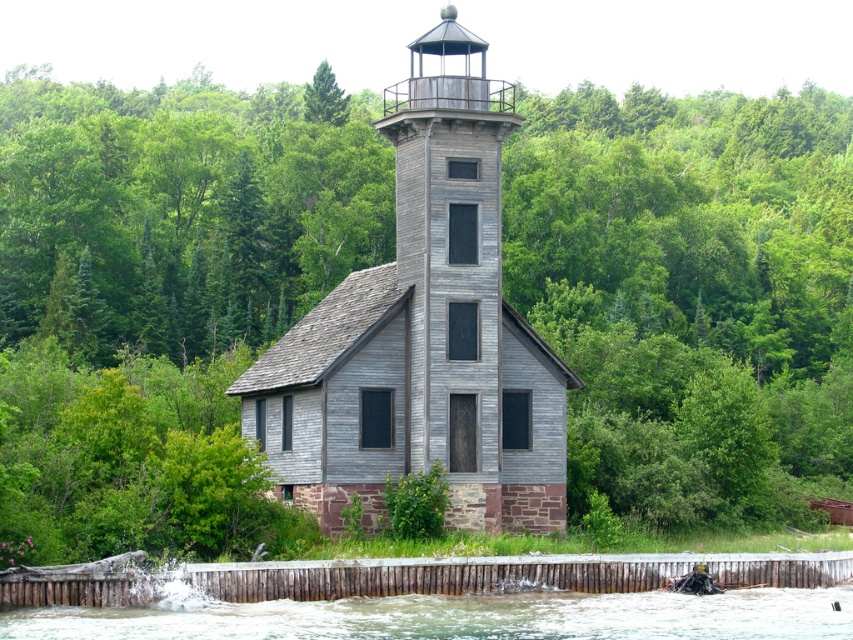
You are standing at the camera position and want to take a photo of the gray wood tower at center. If your camera has a maximum focus range of 60 meters, will it be able to capture the tower clearly?

The gray wood tower at center and camera are 61.49 meters apart, which exceeds the camera maximum focus range of 60 meters. Therefore, the camera cannot capture the tower clearly.

You are a hiker who has reached the base of the gray wood tower at center. You want to get to the white frothy water at lower center. Which direction should you move relative to the tower?

The gray wood tower at center is located above the white frothy water at lower center, so you should move downward towards the white frothy water at lower center to reach it.